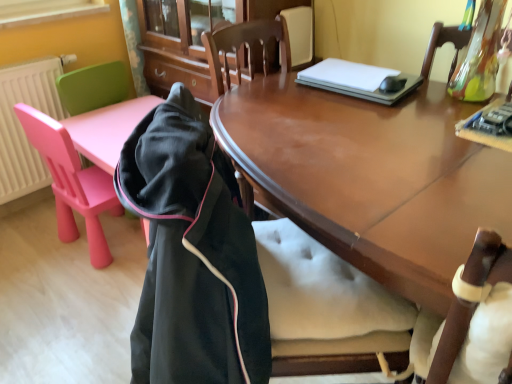
Question: Is black fleece jacket at left wider or thinner than shiny brown wood desk at center?

Choices:
 (A) thin
 (B) wide

Answer: (A)

Question: In terms of size, does black fleece jacket at left appear bigger or smaller than shiny brown wood desk at center?

Choices:
 (A) small
 (B) big

Answer: (A)

Question: Which of these objects is positioned closest to the pink plastic chair at left, placed as the 1th chair when sorted from front to back?

Choices:
 (A) matte wood cabinet at center
 (B) black fleece jacket at left
 (C) shiny brown wood desk at center
 (D) white plastic radiator at left
 (E) pink plastic chair at left, the second chair positioned from the front

Answer: (E)

Question: Estimate the real-world distances between objects in this image. Which object is closer to the pink plastic chair at left, the 2th chair when ordered from back to front?

Choices:
 (A) pink plastic chair at left, the second chair positioned from the front
 (B) matte wood cabinet at center
 (C) black fleece jacket at left
 (D) white plastic radiator at left
 (E) shiny brown wood desk at center

Answer: (A)